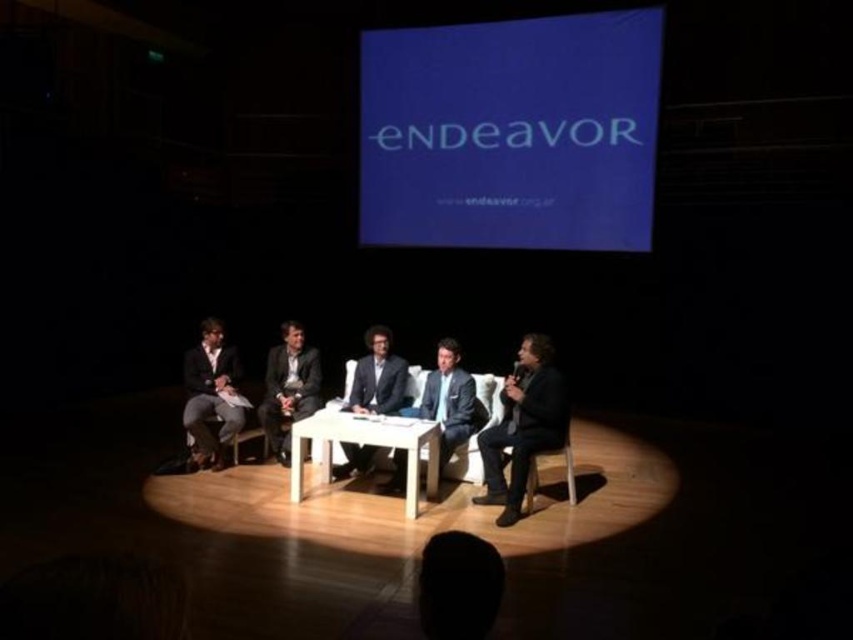
Question: From the image, what is the correct spatial relationship of matte black suit at left in relation to dark gray suit at center?

Choices:
 (A) left
 (B) right

Answer: (A)

Question: Is matte black suit at left thinner than light blue suit at center?

Choices:
 (A) no
 (B) yes

Answer: (B)

Question: Which point appears farthest from the camera in this image?

Choices:
 (A) (x=347, y=412)
 (B) (x=537, y=332)
 (C) (x=300, y=348)

Answer: (B)

Question: Where is matte black suit at left located in relation to matte black suit at center in the image?

Choices:
 (A) right
 (B) left

Answer: (B)

Question: Which point is farther to the camera?

Choices:
 (A) matte black suit at left
 (B) brown wooden chair at center
 (C) light blue suit at center
 (D) white wooden table at center

Answer: (A)

Question: Based on their relative distances, which object is nearer to the matte black suit at center?

Choices:
 (A) matte black suit at left
 (B) brown wooden chair at center

Answer: (B)